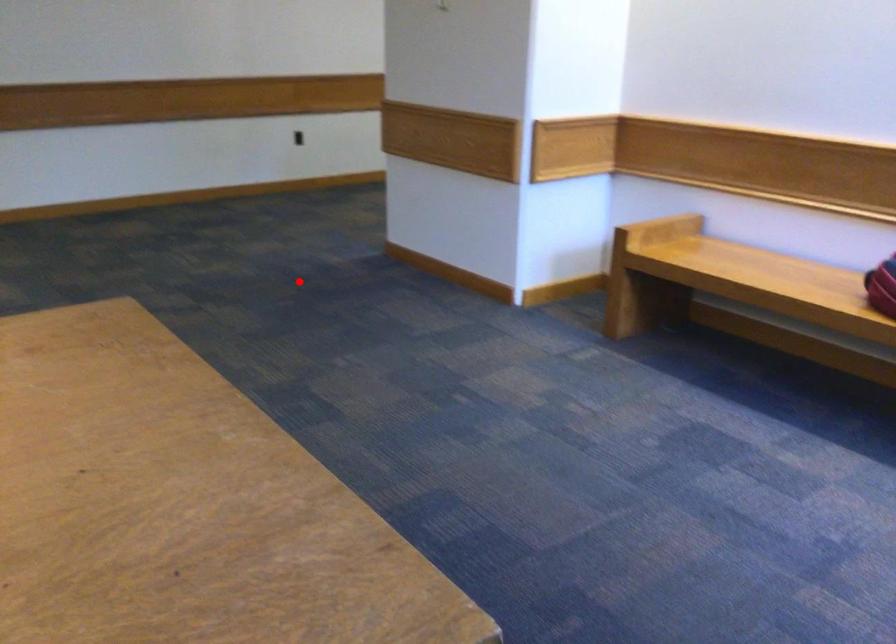
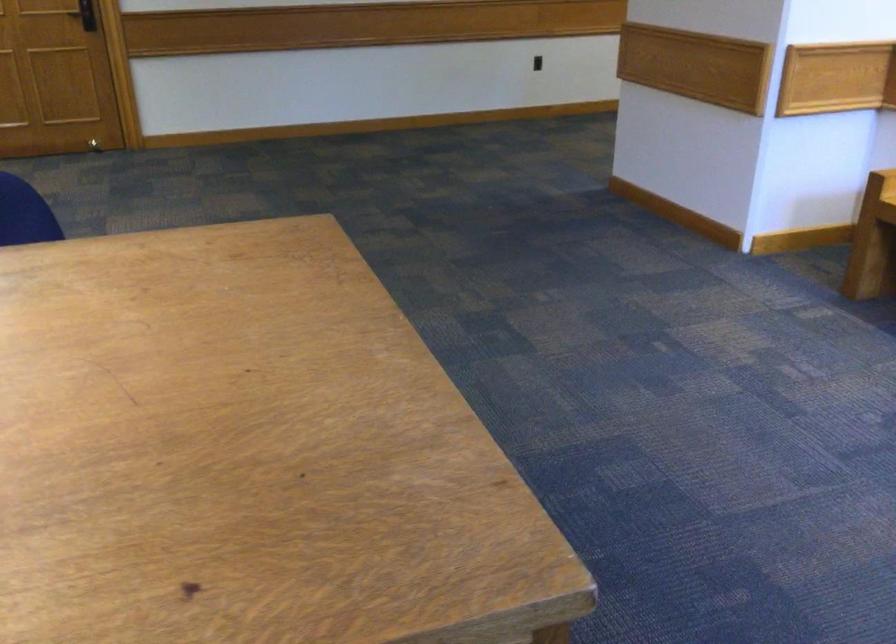
Locate, in the second image, the point that corresponds to the highlighted location in the first image.

(515, 214)